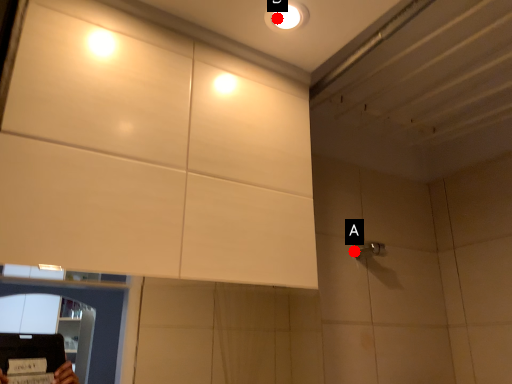
Question: Two points are circled on the image, labeled by A and B beside each circle. Among these points, which one is farthest from the camera?

Choices:
 (A) A is further
 (B) B is further

Answer: (A)